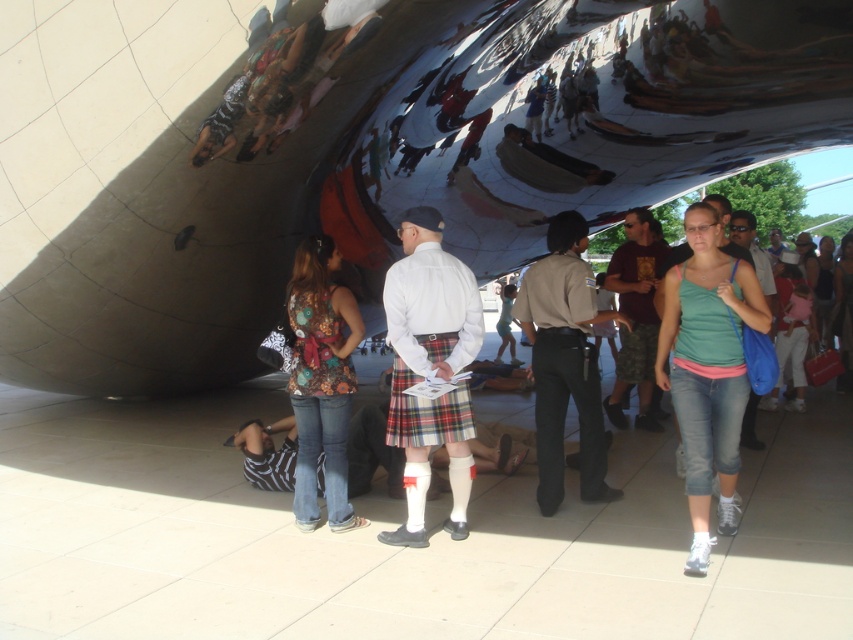
You are a photographer trying to capture the reflection of the two people in the center of the sculpture. The green cotton tank top at center and the matte black shirt at center are both visible in the reflection. Which one will appear larger in the reflection?

The green cotton tank top at center will appear larger in the reflection because it is bigger than the matte black shirt at center.

You are a photographer standing in front of the Cloud Gate sculpture. You notice two people wearing a green cotton tank top at center and a matte black shirt at center. Which clothing item is taller?

The green cotton tank top at center is taller than the matte black shirt at center.